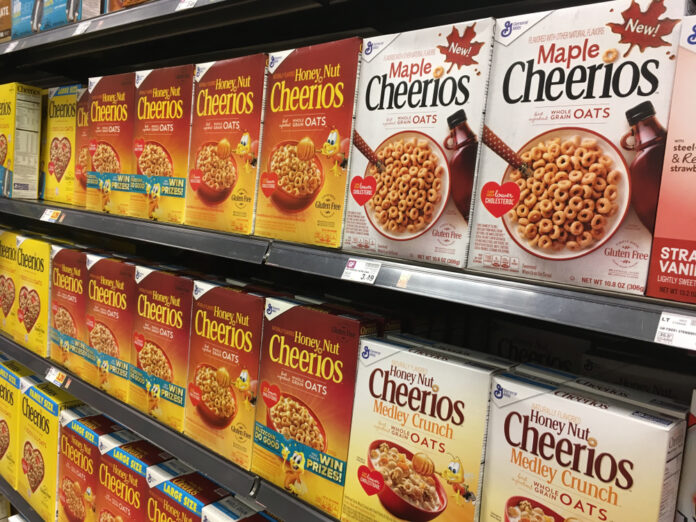
The width and height of the screenshot is (696, 522). Find the location of `yellow box of plain cheerios`. yellow box of plain cheerios is located at coordinates (40, 421), (8, 397), (26, 260), (8, 253), (55, 120), (13, 122).